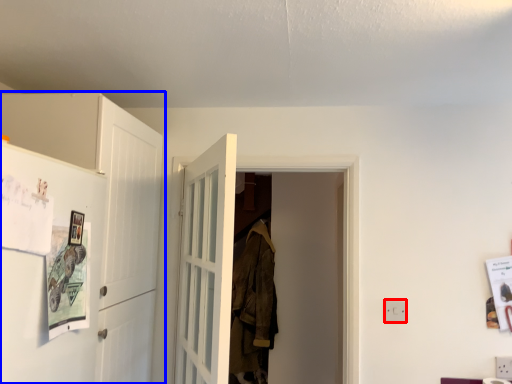
Question: Which of the following is the farthest to the observer, electric outlet (highlighted by a red box) or cabinetry (highlighted by a blue box)?

Choices:
 (A) electric outlet
 (B) cabinetry

Answer: (A)